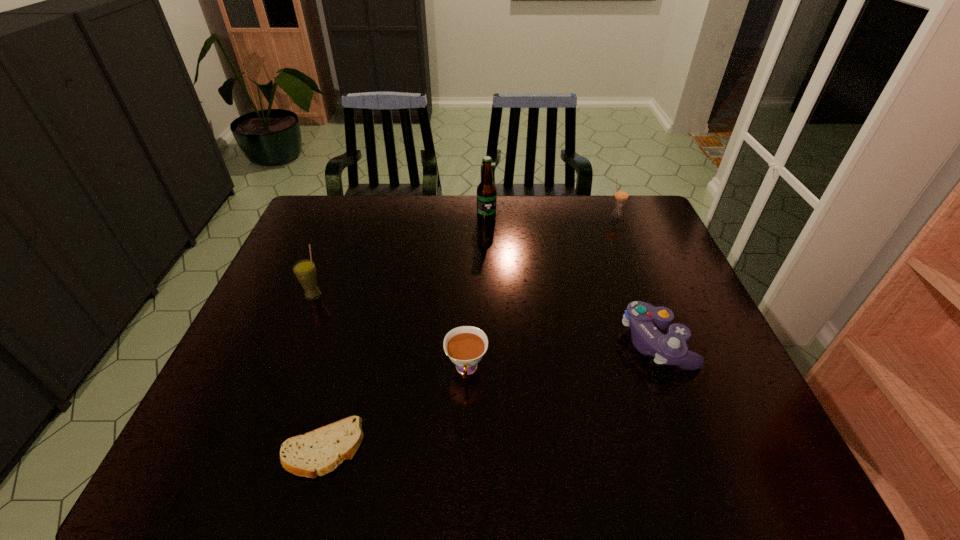
This screenshot has height=540, width=960. What are the coordinates of `free space that satisfies the following two spatial constraints: 1. on the label of the beer bottle; 2. on the left side of the control` in the screenshot? It's located at (489, 342).

Image resolution: width=960 pixels, height=540 pixels. Find the location of `free space in the image that satisfies the following two spatial constraints: 1. on the label of the beer bottle; 2. on the right side of the control`. free space in the image that satisfies the following two spatial constraints: 1. on the label of the beer bottle; 2. on the right side of the control is located at coordinates (489, 342).